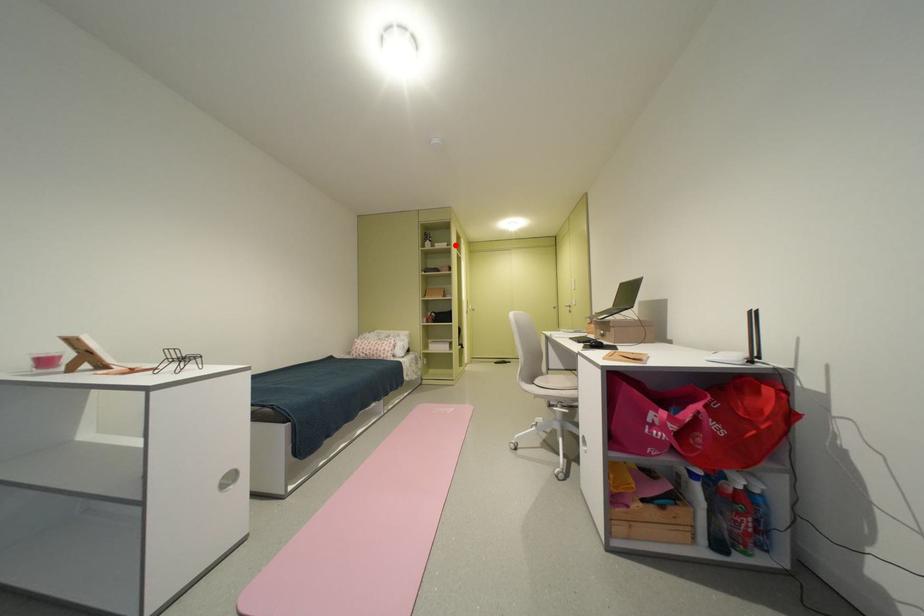
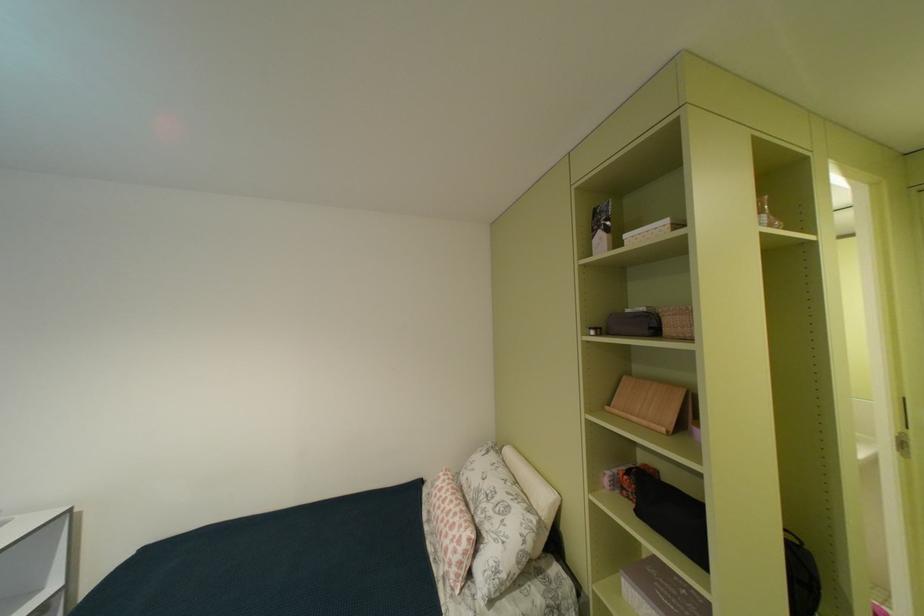
Find the pixel in the second image that matches the highlighted location in the first image.

(676, 223)